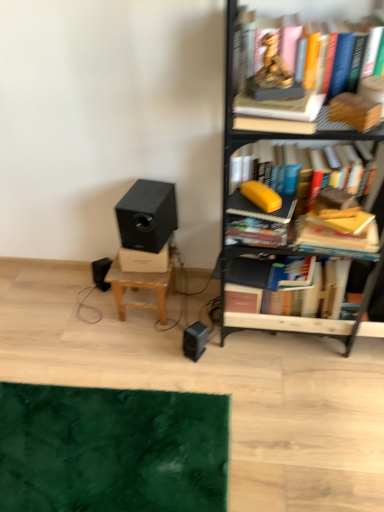
The height and width of the screenshot is (512, 384). Find the location of `vacant space positioned to the left of wooden stool at lower center`. vacant space positioned to the left of wooden stool at lower center is located at coordinates (95, 316).